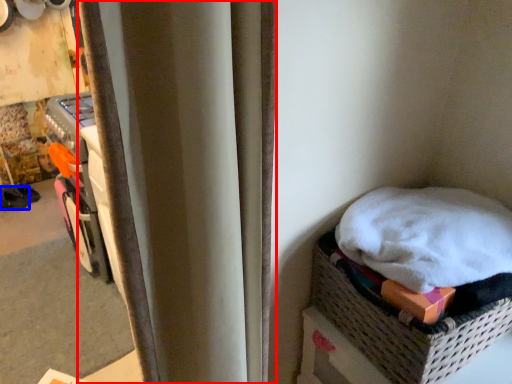
Question: Which object is closer to the camera taking this photo, curtain (highlighted by a red box) or footwear (highlighted by a blue box)?

Choices:
 (A) curtain
 (B) footwear

Answer: (A)